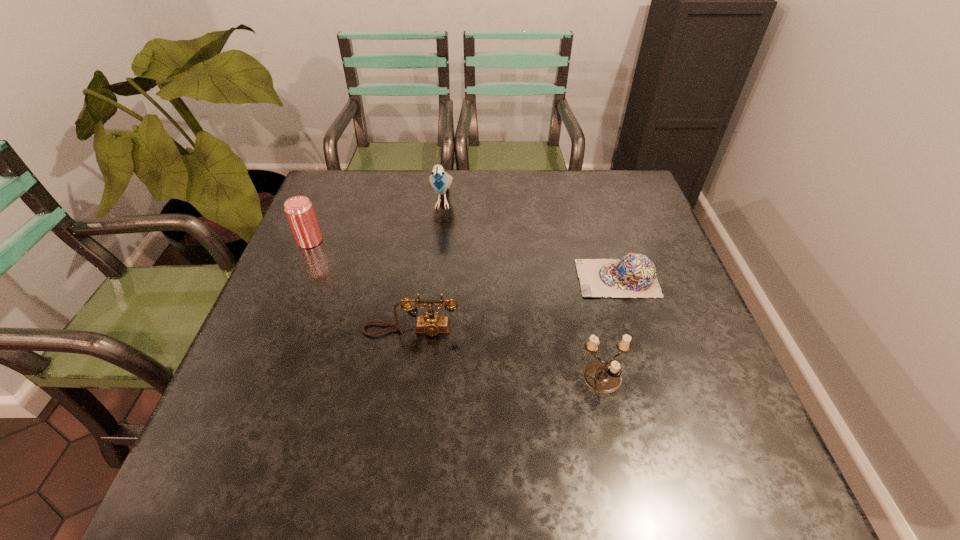
Identify the location of free spot between the fourth farthest object and the tallest object. The width and height of the screenshot is (960, 540). (427, 265).

At what (x,y) coordinates should I click in order to perform the action: click on free space between the telephone and the candle holder. Please return your answer as a coordinate pair (x, y). Image resolution: width=960 pixels, height=540 pixels. Looking at the image, I should click on tap(507, 355).

Find the location of `free space between the leftmost object and the third nearest object`. free space between the leftmost object and the third nearest object is located at coordinates pos(464,260).

You are a GUI agent. You are given a task and a screenshot of the screen. Output one action in this format:
    pyautogui.click(x=<x>, y=<y>)
    Task: Click on the vacant region between the beer can and the nearest object
    This screenshot has width=960, height=540.
    Given the screenshot: What is the action you would take?
    pyautogui.click(x=456, y=310)

The image size is (960, 540). In order to click on object that is the third nearest to the second farthest object in this screenshot , I will do `click(634, 275)`.

What are the coordinates of `object identified as the second closest to the nearest object` in the screenshot? It's located at (432, 324).

The height and width of the screenshot is (540, 960). Identify the location of vacant space that satisfies the following two spatial constraints: 1. on the front-facing side of the candle holder; 2. on the right side of the second nearest object. (404, 380).

Find the location of a particular element. The width and height of the screenshot is (960, 540). free space that satisfies the following two spatial constraints: 1. at the face of the nearest object; 2. on the right side of the tallest object is located at coordinates (424, 380).

At what (x,y) coordinates should I click in order to perform the action: click on free space that satisfies the following two spatial constraints: 1. on the front side of the leftmost object; 2. on the left side of the candle holder. Please return your answer as a coordinate pair (x, y). The width and height of the screenshot is (960, 540). Looking at the image, I should click on pyautogui.click(x=252, y=380).